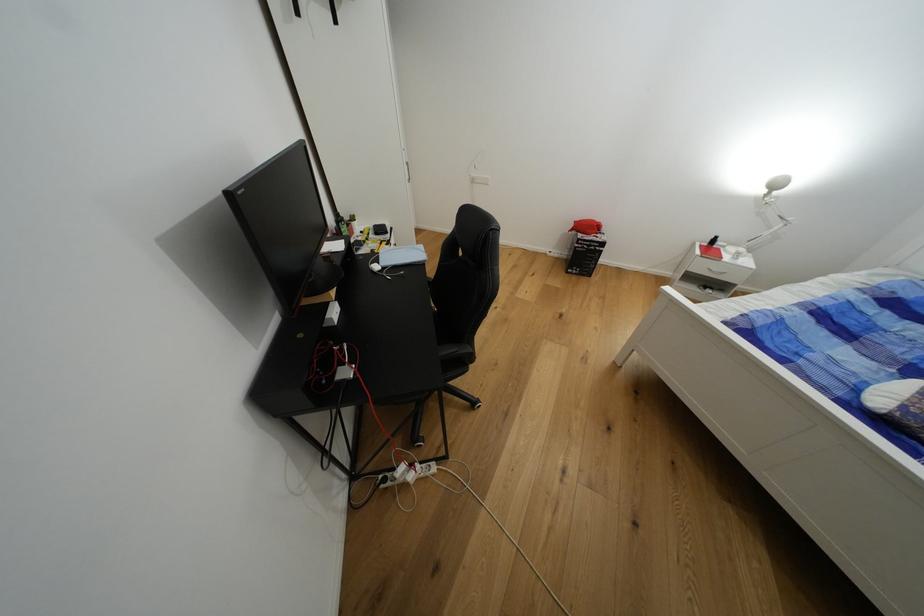
What do you see at coordinates (456, 353) in the screenshot? Image resolution: width=924 pixels, height=616 pixels. I see `the chair armrest` at bounding box center [456, 353].